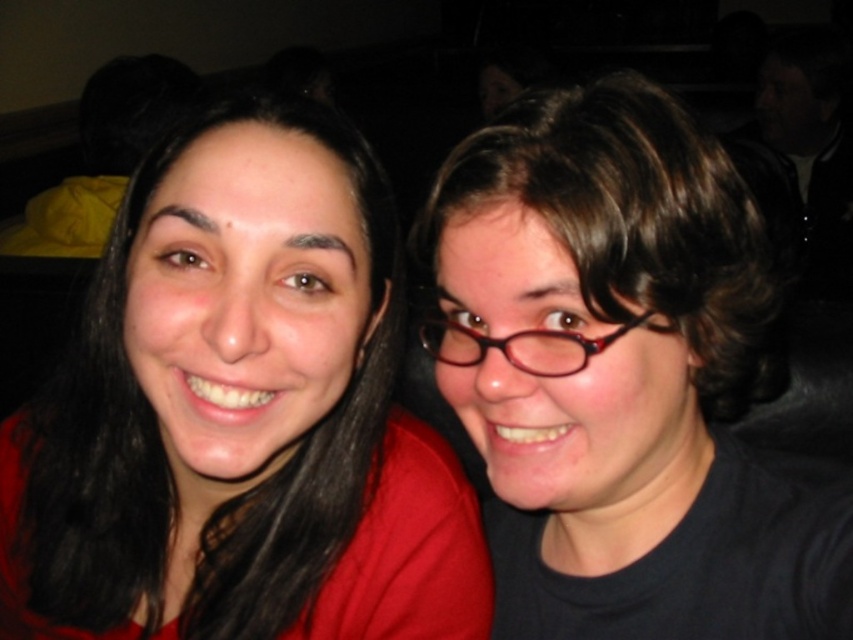
Question: Is the position of matte black hair at left more distant than that of black matte glasses at center?

Choices:
 (A) yes
 (B) no

Answer: (A)

Question: Which object appears closest to the camera in this image?

Choices:
 (A) matte black hair at left
 (B) black matte glasses at center

Answer: (B)

Question: Is matte black hair at left positioned at the back of black matte glasses at center?

Choices:
 (A) yes
 (B) no

Answer: (A)

Question: Does matte black hair at left have a larger size compared to black matte glasses at center?

Choices:
 (A) yes
 (B) no

Answer: (A)